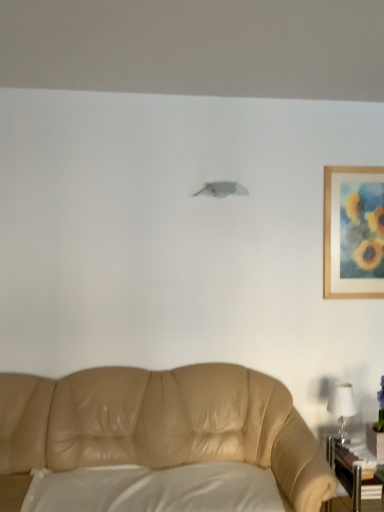
Question: Is white glossy table lamp at right thinner than wooden framed painting at upper right?

Choices:
 (A) no
 (B) yes

Answer: (A)

Question: Is wooden framed painting at upper right at the back of white glossy table lamp at right?

Choices:
 (A) yes
 (B) no

Answer: (B)

Question: Could you tell me if white glossy table lamp at right is turned towards wooden framed painting at upper right?

Choices:
 (A) yes
 (B) no

Answer: (B)

Question: Is white glossy table lamp at right smaller than wooden framed painting at upper right?

Choices:
 (A) yes
 (B) no

Answer: (A)

Question: Does white glossy table lamp at right come in front of wooden framed painting at upper right?

Choices:
 (A) no
 (B) yes

Answer: (B)

Question: Is white glossy table lamp at right further to camera compared to wooden framed painting at upper right?

Choices:
 (A) yes
 (B) no

Answer: (B)

Question: From the image's perspective, is wooden framed painting at upper right on top of white matte pillow at lower center?

Choices:
 (A) no
 (B) yes

Answer: (B)

Question: Is the surface of wooden framed painting at upper right in direct contact with white matte pillow at lower center?

Choices:
 (A) yes
 (B) no

Answer: (B)

Question: From a real-world perspective, is wooden framed painting at upper right positioned over white matte pillow at lower center based on gravity?

Choices:
 (A) no
 (B) yes

Answer: (B)

Question: Does wooden framed painting at upper right turn towards white matte pillow at lower center?

Choices:
 (A) no
 (B) yes

Answer: (A)

Question: Considering the relative positions of wooden framed painting at upper right and white matte pillow at lower center in the image provided, is wooden framed painting at upper right to the left of white matte pillow at lower center from the viewer's perspective?

Choices:
 (A) no
 (B) yes

Answer: (A)

Question: Does wooden framed painting at upper right have a lesser height compared to white matte pillow at lower center?

Choices:
 (A) yes
 (B) no

Answer: (B)

Question: Is white matte pillow at lower center directly adjacent to white glossy table lamp at right?

Choices:
 (A) no
 (B) yes

Answer: (A)